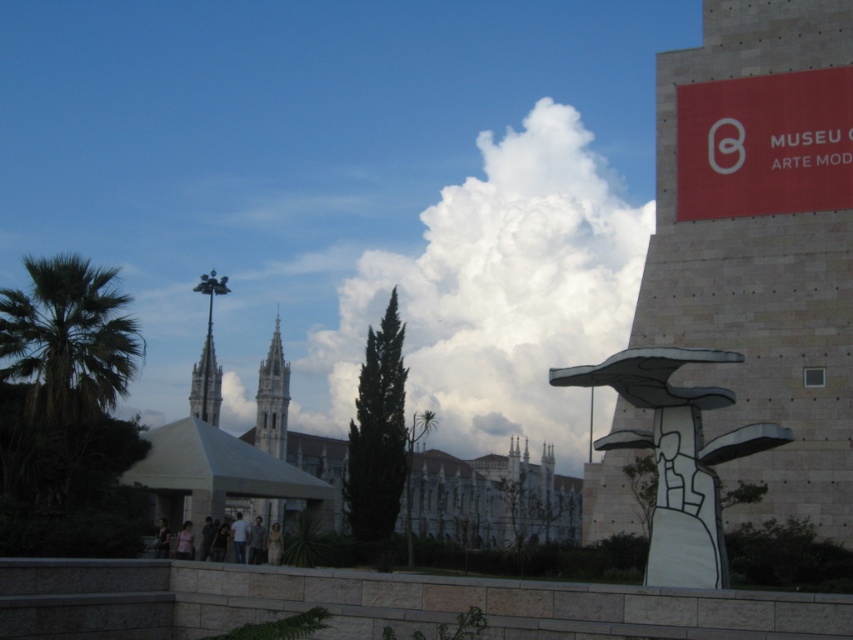
Who is positioned more to the right, green leafy palm at left or clear glass spire at upper left?

From the viewer's perspective, green leafy palm at left appears more on the right side.

The height and width of the screenshot is (640, 853). In order to click on green leafy palm at left in this screenshot , I will do `click(68, 339)`.

Does point (766, 196) come behind point (38, 374)?

Yes, it is.

Does red fabric sign at upper right appear on the right side of green leafy palm at left?

Yes, red fabric sign at upper right is to the right of green leafy palm at left.

Is point (699, 83) closer to viewer compared to point (0, 320)?

No.

Locate an element on the screen. red fabric sign at upper right is located at coordinates (764, 145).

What do you see at coordinates (500, 291) in the screenshot?
I see `white fluffy cloud at center` at bounding box center [500, 291].

Who is higher up, white fluffy cloud at center or green leafy palm at left?

Positioned higher is white fluffy cloud at center.

Measure the distance between white fluffy cloud at center and camera.

The distance of white fluffy cloud at center from camera is 81.73 meters.

What are the coordinates of `white fluffy cloud at center` in the screenshot? It's located at tap(500, 291).